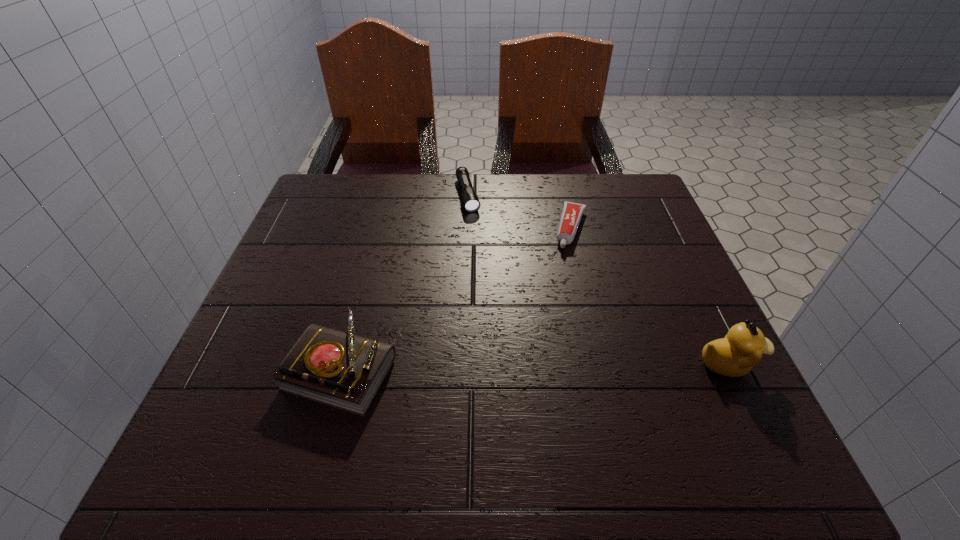
Choose which object is the second nearest neighbor to the flashlight. Please provide its 2D coordinates. Your answer should be formatted as a tuple, i.e. [(x, y)], where the tuple contains the x and y coordinates of a point satisfying the conditions above.

[(342, 370)]

This screenshot has width=960, height=540. I want to click on free space that satisfies the following two spatial constraints: 1. on the front side of the tallest object; 2. on the face of the toothpaste, so click(604, 363).

The height and width of the screenshot is (540, 960). In order to click on vacant space that satisfies the following two spatial constraints: 1. on the front side of the rightmost object; 2. on the face of the second object from right to left in this screenshot , I will do `click(604, 363)`.

Locate an element on the screen. blank area in the image that satisfies the following two spatial constraints: 1. on the front side of the tallest object; 2. on the face of the flashlight is located at coordinates (462, 363).